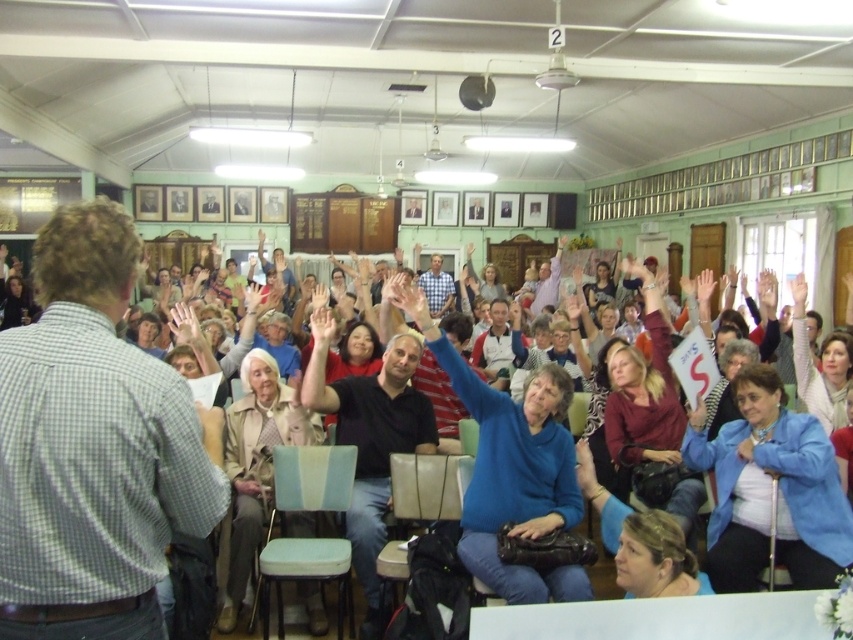
Which is behind, point (694, 413) or point (250, 513)?

The point (694, 413) is more distant.

Image resolution: width=853 pixels, height=640 pixels. Find the location of `blue fabric jacket at center`. blue fabric jacket at center is located at coordinates (770, 490).

Between light beige fabric jacket at center and maroon fabric sweater at center, which one appears on the right side from the viewer's perspective?

maroon fabric sweater at center is more to the right.

Does light beige fabric jacket at center come behind maroon fabric sweater at center?

No, it is in front of maroon fabric sweater at center.

Which is behind, point (233, 616) or point (683, 518)?

Positioned behind is point (683, 518).

Where is `light beige fabric jacket at center`? The width and height of the screenshot is (853, 640). light beige fabric jacket at center is located at coordinates (256, 461).

Is blue fabric jacket at center thinner than blue sweater at center?

No, blue fabric jacket at center is not thinner than blue sweater at center.

Which is behind, point (726, 499) or point (840, 390)?

Point (840, 390)

Is point (795, 499) farther from viewer compared to point (801, 371)?

That is False.

Identify the location of blue fabric jacket at center. (770, 490).